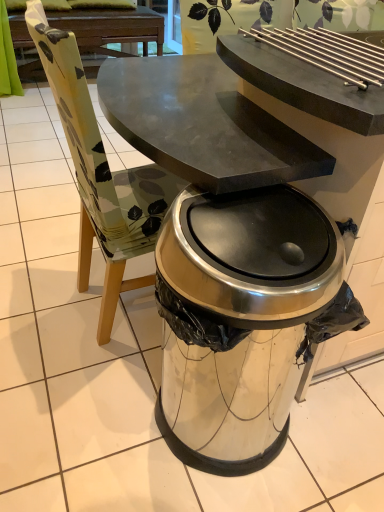
What do you see at coordinates (238, 319) in the screenshot? I see `satin silver trash can at center` at bounding box center [238, 319].

Locate an element on the screen. The image size is (384, 512). satin silver trash can at center is located at coordinates (238, 319).

The image size is (384, 512). What do you see at coordinates (110, 29) in the screenshot?
I see `dark brown wood picnic table at upper center` at bounding box center [110, 29].

At what (x,y) coordinates should I click in order to perform the action: click on dark brown wood picnic table at upper center. Please return your answer as a coordinate pair (x, y). The height and width of the screenshot is (512, 384). Looking at the image, I should click on (110, 29).

In order to face dark brown wood picnic table at upper center, should I rotate leftwards or rightwards?

To align with it, rotate left about 13.596°.

The width and height of the screenshot is (384, 512). Identify the location of satin silver trash can at center. (238, 319).

Can you confirm if dark brown wood picnic table at upper center is positioned to the right of satin silver trash can at center?

Incorrect, dark brown wood picnic table at upper center is not on the right side of satin silver trash can at center.

Consider the image. Is dark brown wood picnic table at upper center behind satin silver trash can at center?

That is True.

Which is closer to the camera, (34, 59) or (305, 271)?

The point (305, 271) is more forward.

Consider the image. From the image's perspective, is dark brown wood picnic table at upper center on top of satin silver trash can at center?

Correct, dark brown wood picnic table at upper center appears higher than satin silver trash can at center in the image.

From a real-world perspective, is dark brown wood picnic table at upper center positioned above or below satin silver trash can at center?

dark brown wood picnic table at upper center is below satin silver trash can at center.

Which of these two, dark brown wood picnic table at upper center or satin silver trash can at center, is wider?

Wider between the two is dark brown wood picnic table at upper center.

In terms of height, does dark brown wood picnic table at upper center look taller or shorter compared to satin silver trash can at center?

Clearly, dark brown wood picnic table at upper center is shorter compared to satin silver trash can at center.

Considering the relative sizes of dark brown wood picnic table at upper center and satin silver trash can at center in the image provided, is dark brown wood picnic table at upper center bigger than satin silver trash can at center?

Indeed, dark brown wood picnic table at upper center has a larger size compared to satin silver trash can at center.

Is dark brown wood picnic table at upper center situated inside satin silver trash can at center or outside?

The correct answer is: outside.

Can you see dark brown wood picnic table at upper center touching satin silver trash can at center?

No, dark brown wood picnic table at upper center is not beside satin silver trash can at center.

Is dark brown wood picnic table at upper center positioned with its back to satin silver trash can at center?

No, satin silver trash can at center is not at the back of dark brown wood picnic table at upper center.

How many degrees apart are the facing directions of dark brown wood picnic table at upper center and satin silver trash can at center?

The angular difference between dark brown wood picnic table at upper center and satin silver trash can at center is 0.0103 degrees.

Image resolution: width=384 pixels, height=512 pixels. I want to click on picnic table below the satin silver trash can at center (from a real-world perspective), so click(x=110, y=29).

Looking at this image, which object is positioned more to the left, satin silver trash can at center or dark brown wood picnic table at upper center?

Positioned to the left is dark brown wood picnic table at upper center.

Between satin silver trash can at center and dark brown wood picnic table at upper center, which one is positioned behind?

dark brown wood picnic table at upper center is more distant.

Is point (162, 317) in front of point (97, 66)?

Yes, point (162, 317) is closer to viewer.

From the image's perspective, is satin silver trash can at center positioned above or below dark brown wood picnic table at upper center?

satin silver trash can at center is situated lower than dark brown wood picnic table at upper center in the image.

From a real-world perspective, is satin silver trash can at center located higher than dark brown wood picnic table at upper center?

Yes, from a real-world perspective, satin silver trash can at center is above dark brown wood picnic table at upper center.

Considering the relative sizes of satin silver trash can at center and dark brown wood picnic table at upper center in the image provided, is satin silver trash can at center wider than dark brown wood picnic table at upper center?

In fact, satin silver trash can at center might be narrower than dark brown wood picnic table at upper center.

Is satin silver trash can at center taller or shorter than dark brown wood picnic table at upper center?

satin silver trash can at center is taller than dark brown wood picnic table at upper center.

Considering the relative sizes of satin silver trash can at center and dark brown wood picnic table at upper center in the image provided, is satin silver trash can at center smaller than dark brown wood picnic table at upper center?

Indeed, satin silver trash can at center has a smaller size compared to dark brown wood picnic table at upper center.

Based on the photo, is satin silver trash can at center positioned beyond the bounds of dark brown wood picnic table at upper center?

Yes, satin silver trash can at center is not within dark brown wood picnic table at upper center.

Is satin silver trash can at center with dark brown wood picnic table at upper center?

satin silver trash can at center and dark brown wood picnic table at upper center are clearly separated.

Could you tell me if satin silver trash can at center is facing dark brown wood picnic table at upper center?

No, satin silver trash can at center is not turned towards dark brown wood picnic table at upper center.

What's the angular difference between satin silver trash can at center and dark brown wood picnic table at upper center's facing directions?

The facing directions of satin silver trash can at center and dark brown wood picnic table at upper center are 0.0103 degrees apart.

At what (x,y) coordinates should I click in order to perform the action: click on trash bin/can lying in front of the dark brown wood picnic table at upper center. Please return your answer as a coordinate pair (x, y). Image resolution: width=384 pixels, height=512 pixels. Looking at the image, I should click on (238, 319).

Locate an element on the screen. The image size is (384, 512). trash bin/can in front of the dark brown wood picnic table at upper center is located at coordinates (238, 319).

Where is `trash bin/can below the dark brown wood picnic table at upper center (from the image's perspective)`? Image resolution: width=384 pixels, height=512 pixels. trash bin/can below the dark brown wood picnic table at upper center (from the image's perspective) is located at coordinates (238, 319).